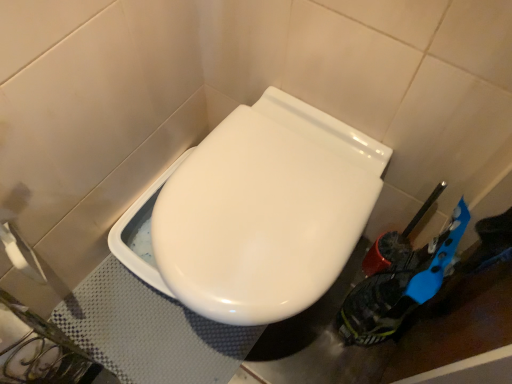
The image size is (512, 384). What do you see at coordinates (259, 212) in the screenshot?
I see `white glossy toilet at center` at bounding box center [259, 212].

At what (x,y) coordinates should I click in order to perform the action: click on white glossy toilet at center. Please return your answer as a coordinate pair (x, y). Looking at the image, I should click on (259, 212).

Where is `white glossy toilet at center`? The image size is (512, 384). white glossy toilet at center is located at coordinates (259, 212).